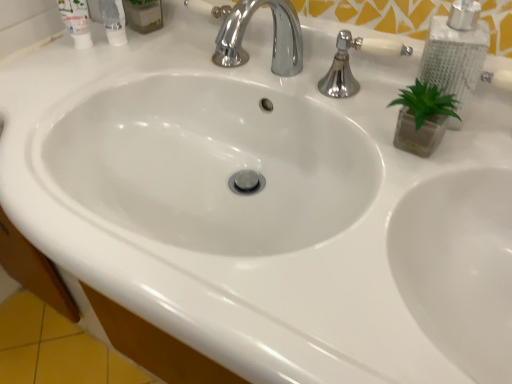
Question: Can you confirm if polished chrome faucet at upper center is shorter than silver metallic soap dispenser at upper right?

Choices:
 (A) no
 (B) yes

Answer: (B)

Question: Is silver metallic soap dispenser at upper right a part of polished chrome faucet at upper center?

Choices:
 (A) no
 (B) yes

Answer: (A)

Question: Does polished chrome faucet at upper center have a larger size compared to silver metallic soap dispenser at upper right?

Choices:
 (A) no
 (B) yes

Answer: (A)

Question: Is polished chrome faucet at upper center beside silver metallic soap dispenser at upper right?

Choices:
 (A) no
 (B) yes

Answer: (A)

Question: Is polished chrome faucet at upper center at the left side of silver metallic soap dispenser at upper right?

Choices:
 (A) no
 (B) yes

Answer: (B)

Question: Is polished chrome faucet at upper center oriented towards silver metallic soap dispenser at upper right?

Choices:
 (A) no
 (B) yes

Answer: (A)

Question: Does polished chrome faucet at upper center have a greater height compared to white plastic mouthwash at upper left, the second mouthwash positioned from the left?

Choices:
 (A) yes
 (B) no

Answer: (B)

Question: Is polished chrome faucet at upper center at the right side of white plastic mouthwash at upper left, the second mouthwash positioned from the left?

Choices:
 (A) yes
 (B) no

Answer: (A)

Question: Can you confirm if polished chrome faucet at upper center is wider than white plastic mouthwash at upper left, the first mouthwash viewed from the right?

Choices:
 (A) no
 (B) yes

Answer: (B)

Question: From the image's perspective, is polished chrome faucet at upper center beneath white plastic mouthwash at upper left, the second mouthwash positioned from the left?

Choices:
 (A) no
 (B) yes

Answer: (B)

Question: Considering the relative sizes of polished chrome faucet at upper center and white plastic mouthwash at upper left, the first mouthwash viewed from the right, in the image provided, is polished chrome faucet at upper center bigger than white plastic mouthwash at upper left, the first mouthwash viewed from the right,?

Choices:
 (A) no
 (B) yes

Answer: (B)

Question: Is polished chrome faucet at upper center not near white plastic mouthwash at upper left, the first mouthwash viewed from the right?

Choices:
 (A) yes
 (B) no

Answer: (B)

Question: Considering the relative positions of silver metallic soap dispenser at upper right and white plastic mouthwash at upper left, the second mouthwash positioned from the left, in the image provided, is silver metallic soap dispenser at upper right to the left of white plastic mouthwash at upper left, the second mouthwash positioned from the left, from the viewer's perspective?

Choices:
 (A) no
 (B) yes

Answer: (A)